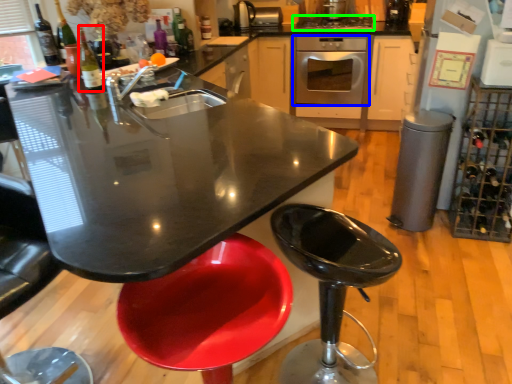
Question: Which object is the closest to the bottle (highlighted by a red box)? Choose among these: home appliance (highlighted by a blue box) or kitchen appliance (highlighted by a green box).

Choices:
 (A) home appliance
 (B) kitchen appliance

Answer: (B)